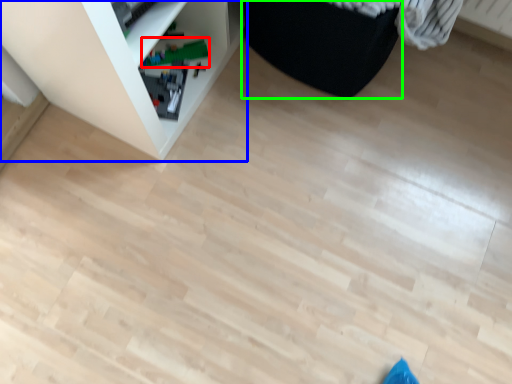
Question: Which object is the closest to the toy (highlighted by a red box)? Choose among these: shelf (highlighted by a blue box) or furniture (highlighted by a green box).

Choices:
 (A) shelf
 (B) furniture

Answer: (A)